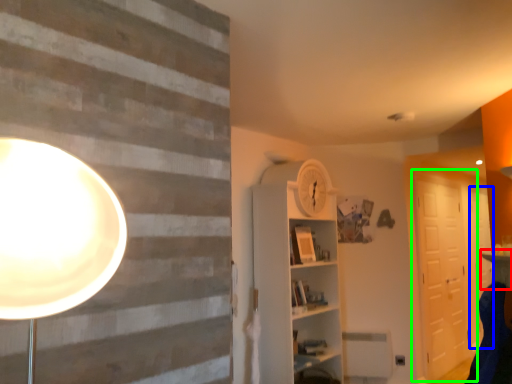
Question: Which is farther away from table (highlighted by a red box)? door (highlighted by a blue box) or barn door (highlighted by a green box)?

Choices:
 (A) door
 (B) barn door

Answer: (A)